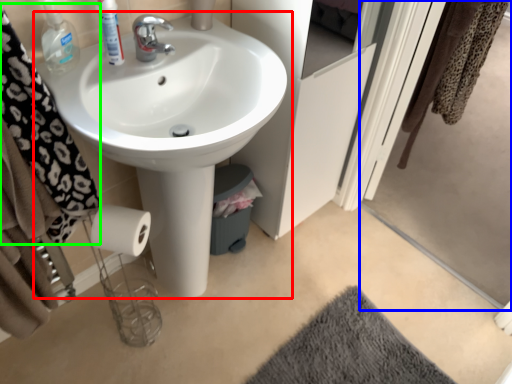
Question: Based on their relative distances, which object is nearer to sink (highlighted by a red box)? Choose from screen door (highlighted by a blue box) and bath towel (highlighted by a green box).

Choices:
 (A) screen door
 (B) bath towel

Answer: (B)